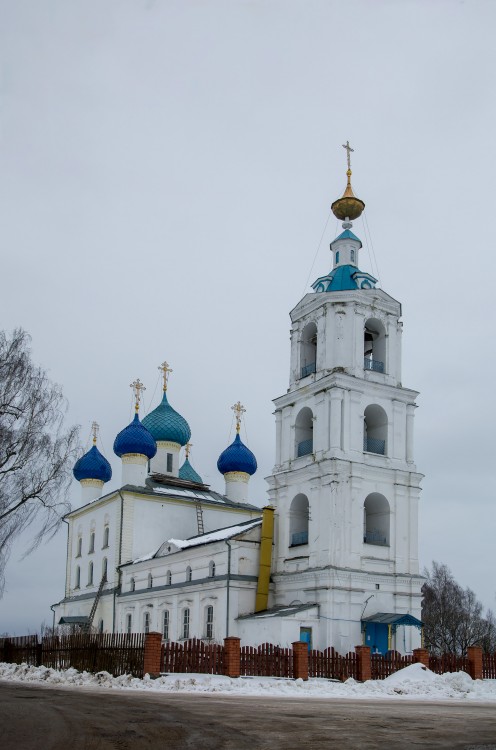
Locate an element on the screen. The height and width of the screenshot is (750, 496). window is located at coordinates (166, 627).